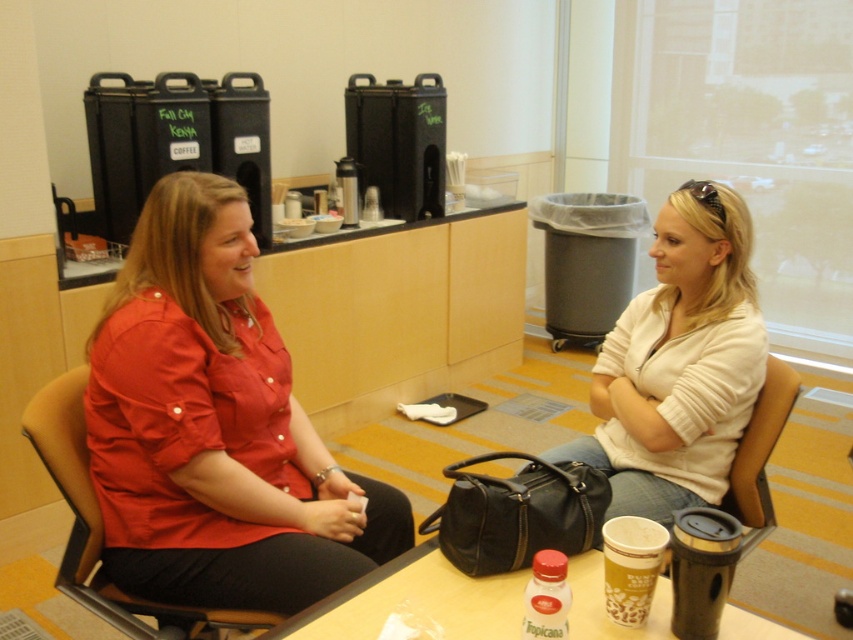
Is point (38, 435) in front of point (625, 573)?

No, (38, 435) is further to viewer.

Which of these two, brown leather chair at left or brown paper cup at lower center, stands shorter?

brown paper cup at lower center is shorter.

Which is behind, point (99, 557) or point (631, 536)?

Positioned behind is point (99, 557).

This screenshot has width=853, height=640. I want to click on brown leather chair at left, so click(102, 528).

Does brown leather chair at left appear over leather-like brown chair at lower right?

Incorrect, brown leather chair at left is not positioned above leather-like brown chair at lower right.

Which is below, brown leather chair at left or leather-like brown chair at lower right?

brown leather chair at left

The height and width of the screenshot is (640, 853). I want to click on brown leather chair at left, so click(x=102, y=528).

Between matte plastic table at center and leather-like brown chair at lower right, which one appears on the right side from the viewer's perspective?

Positioned to the right is leather-like brown chair at lower right.

Can you confirm if matte plastic table at center is wider than leather-like brown chair at lower right?

Indeed, matte plastic table at center has a greater width compared to leather-like brown chair at lower right.

Identify the location of matte plastic table at center. (415, 600).